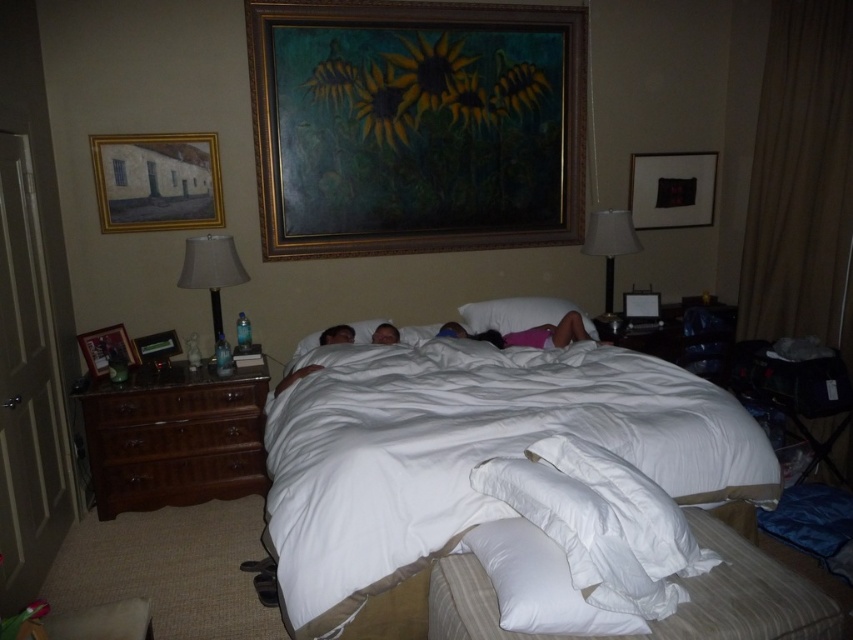
Is white soft pillow at lower center in front of brown wood drawer at left?

Yes, it is in front of brown wood drawer at left.

Locate an element on the screen. white soft pillow at lower center is located at coordinates (538, 582).

Is gold-framed painting at upper center bigger than brown wood drawer at left?

Yes.

Between gold-framed painting at upper center and brown wood drawer at left, which one is positioned lower?

brown wood drawer at left

This screenshot has width=853, height=640. Describe the element at coordinates (415, 125) in the screenshot. I see `gold-framed painting at upper center` at that location.

This screenshot has height=640, width=853. In order to click on gold-framed painting at upper center in this screenshot , I will do [x=415, y=125].

Between gold-framed painting at upper center and black fabric picture frame at upper right, which one has more height?

With more height is gold-framed painting at upper center.

How far apart are gold-framed painting at upper center and black fabric picture frame at upper right?

gold-framed painting at upper center and black fabric picture frame at upper right are 3.28 feet apart.

Who is more forward, (x=488, y=77) or (x=700, y=198)?

Positioned in front is point (x=488, y=77).

Identify the location of gold-framed painting at upper center. (415, 125).